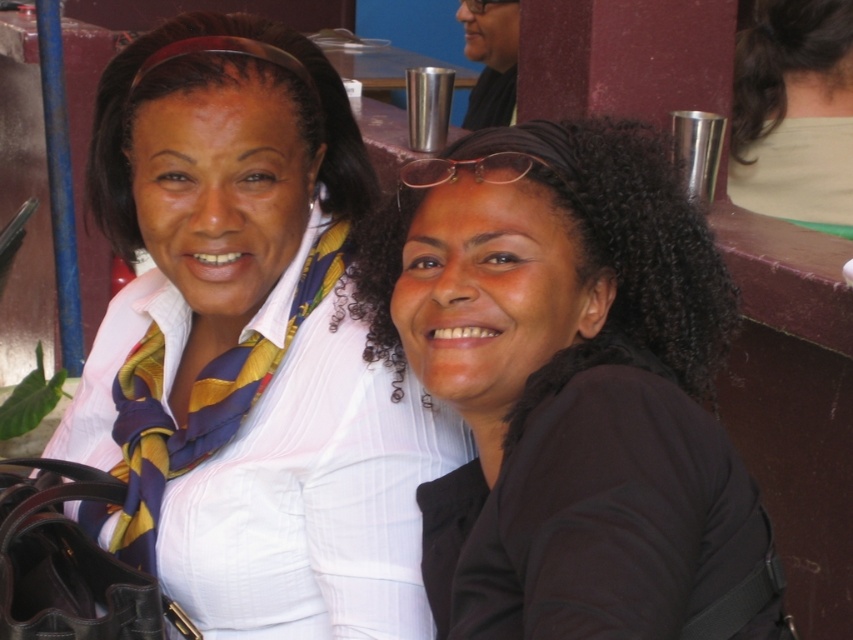
Question: Does black matte hair at center have a lesser width compared to light beige fabric at upper right?

Choices:
 (A) no
 (B) yes

Answer: (A)

Question: Which is nearer to the black matte hair at center?

Choices:
 (A) light beige fabric at upper right
 (B) white striped shirt at center

Answer: (B)

Question: Which object is closer to the camera taking this photo?

Choices:
 (A) white striped shirt at center
 (B) black matte hair at center
 (C) light beige fabric at upper right

Answer: (B)

Question: Does black matte hair at center appear on the right side of light beige fabric at upper right?

Choices:
 (A) yes
 (B) no

Answer: (B)

Question: Does white striped shirt at center have a larger size compared to black matte hair at center?

Choices:
 (A) no
 (B) yes

Answer: (B)

Question: Which of the following is the farthest from the observer?

Choices:
 (A) (849, 36)
 (B) (329, 580)
 (C) (608, 305)

Answer: (A)